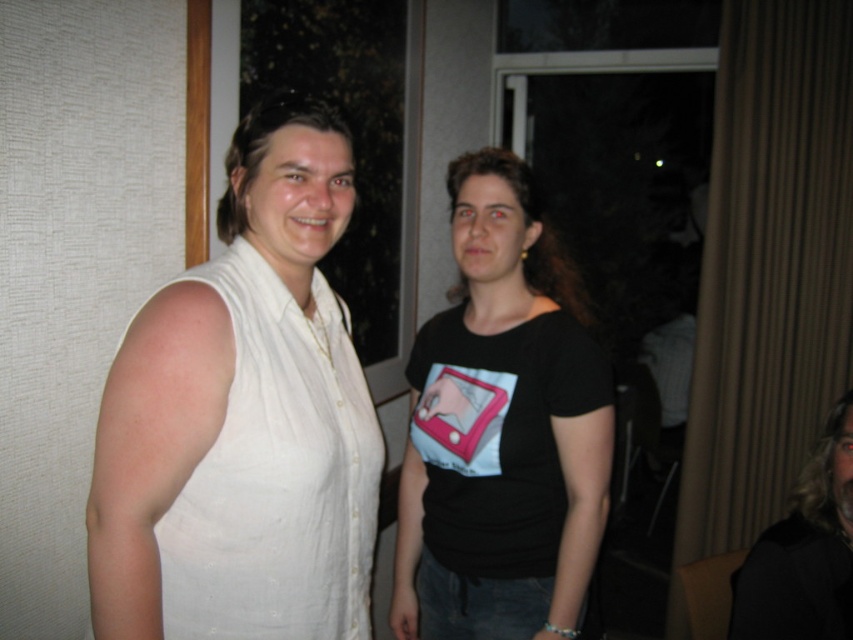
Question: Among these points, which one is farthest from the camera?

Choices:
 (A) (422, 364)
 (B) (199, 548)
 (C) (851, 547)

Answer: (A)

Question: Does white linen dress at left lie behind black matte hair at upper right?

Choices:
 (A) no
 (B) yes

Answer: (A)

Question: Can you confirm if black matte t-shirt at center is positioned to the right of white linen dress at left?

Choices:
 (A) no
 (B) yes

Answer: (B)

Question: Which object is the closest to the black matte hair at upper right?

Choices:
 (A) black matte t-shirt at center
 (B) white linen dress at left

Answer: (A)

Question: From the image, what is the correct spatial relationship of white linen dress at left in relation to black matte hair at upper right?

Choices:
 (A) below
 (B) above

Answer: (B)

Question: Based on their relative distances, which object is nearer to the black matte t-shirt at center?

Choices:
 (A) white linen dress at left
 (B) black matte hair at upper right

Answer: (A)